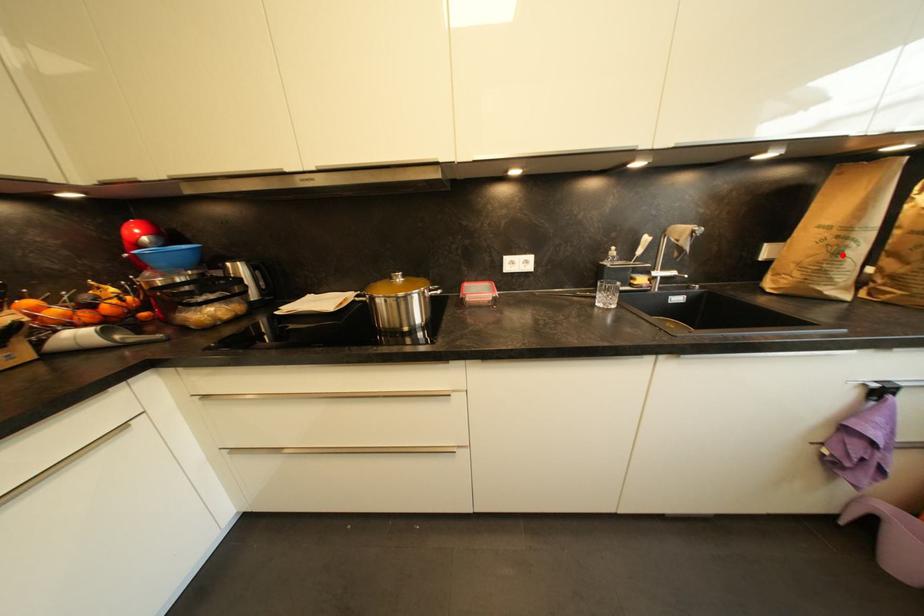
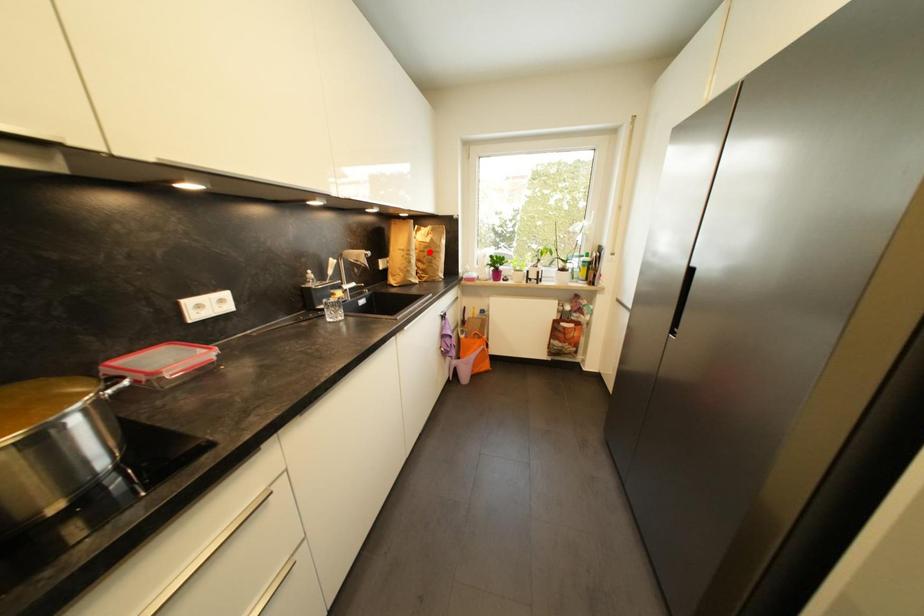
I am providing you with two images of the same scene from different viewpoints. A red point is marked on the first image and another point is marked on the second image. Are the points marked in image1 and image2 representing the same 3D position?

No